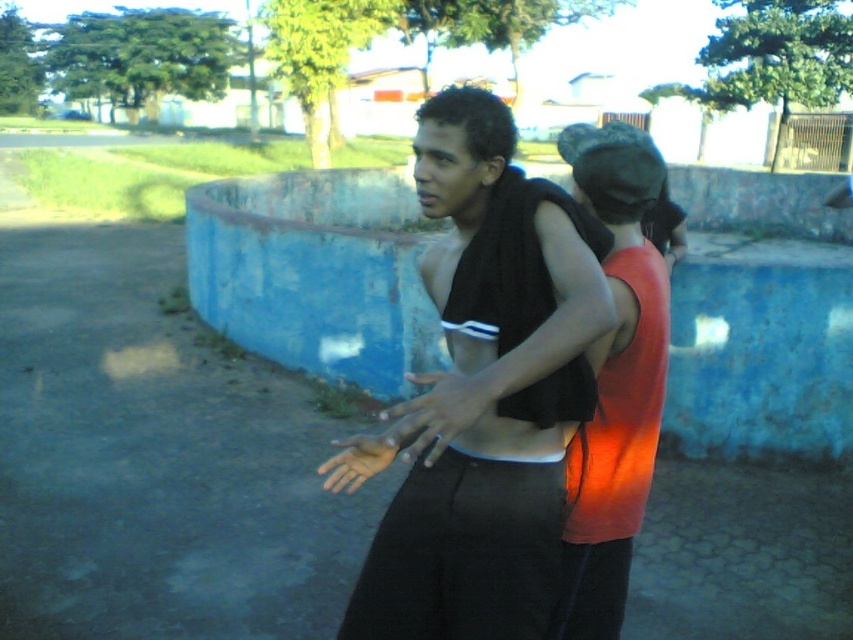
You are trying to decide which tank top to choose based on size. The scene shows a matte black tank top at center and an orange matte tank top at center. Which one is taller?

The matte black tank top at center is much taller than the orange matte tank top at center.

You are a photographer trying to capture a candid shot of the matte black tank top at center. The camera is set to focus on the point at coordinates point (x=486, y=390). Will the matte black tank top at center be in focus?

The point (x=486, y=390) marks the matte black tank top at center, so yes, the matte black tank top at center will be in focus as the camera is focused on that point.

You are a fashion designer observing the scene. There is a person in the foreground wearing dark pants and a towel over their shoulders. You also notice a point at coordinates (486, 390). What clothing item is located at that point?

The point at (486, 390) indicates a matte black tank top at center.